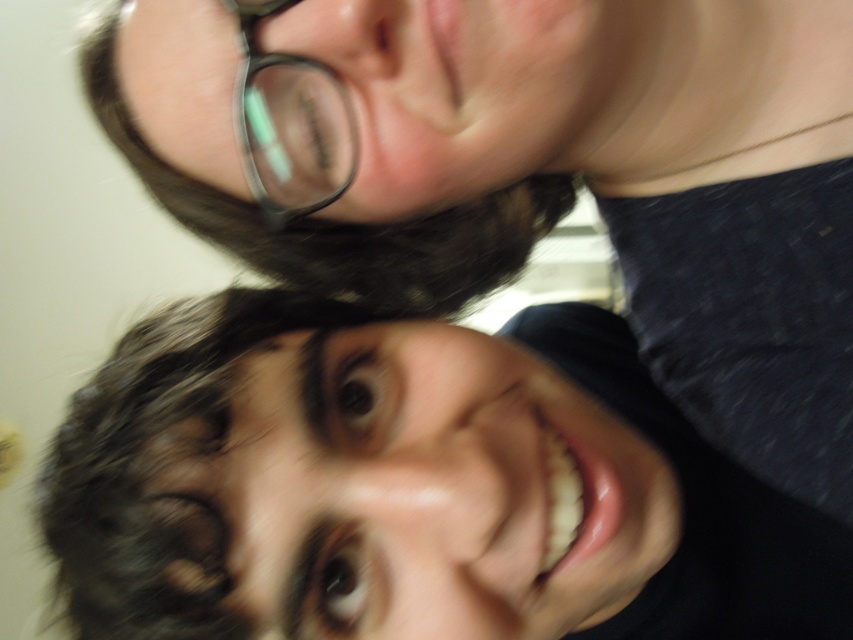
You are looking at the image and want to determine which of the two points, point (479, 628) or point (268, 192), is nearer to you. Based on the scene, can you figure out which one is closer?

Point (479, 628) is closer to the viewer than point (268, 192).

You are a photographer trying to adjust the lighting for a portrait. You notice the dark brown hair at lower left and the black plastic glasses at upper center. Which object is positioned higher in the frame?

The black plastic glasses at upper center are positioned higher in the frame than the dark brown hair at lower left.